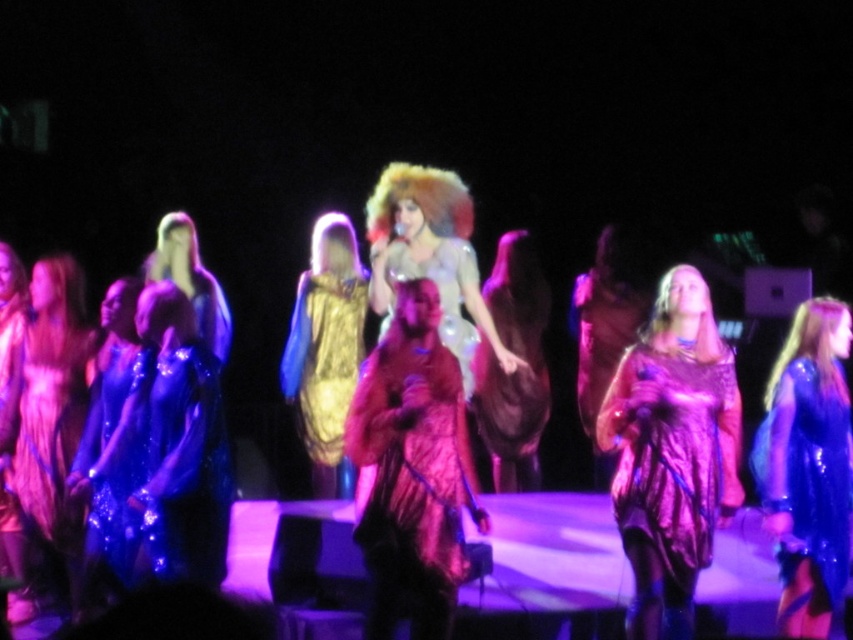
You are a photographer trying to capture the central performer on stage. You notice two points marked in the image at coordinates point (x=387, y=442) and point (x=815, y=481). Which point is closer to the central performer?

Point (x=387, y=442) is closer to the central performer because it is closer to the viewer than point (x=815, y=481).

You are a photographer at the back of the stage. You need to take a photo of both the metallic purple dress at center and the gold sequined dress at center. Which one should you pan your camera to the right to capture first?

The metallic purple dress at center is to the right of the gold sequined dress at center, so you should pan your camera to the right to capture the gold sequined dress at center first before reaching the metallic purple dress at center.

You are a photographer at the back of the stage and want to take a photo of the metallic purple dress at center and the fuzzy pink fur coat at center. Which one is closer to you?

The fuzzy pink fur coat at center is behind the metallic purple dress at center, so the metallic purple dress at center is closer to you.